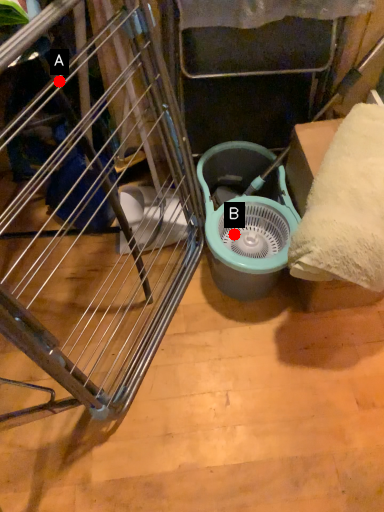
Question: Two points are circled on the image, labeled by A and B beside each circle. Which point appears closest to the camera in this image?

Choices:
 (A) A is closer
 (B) B is closer

Answer: (A)